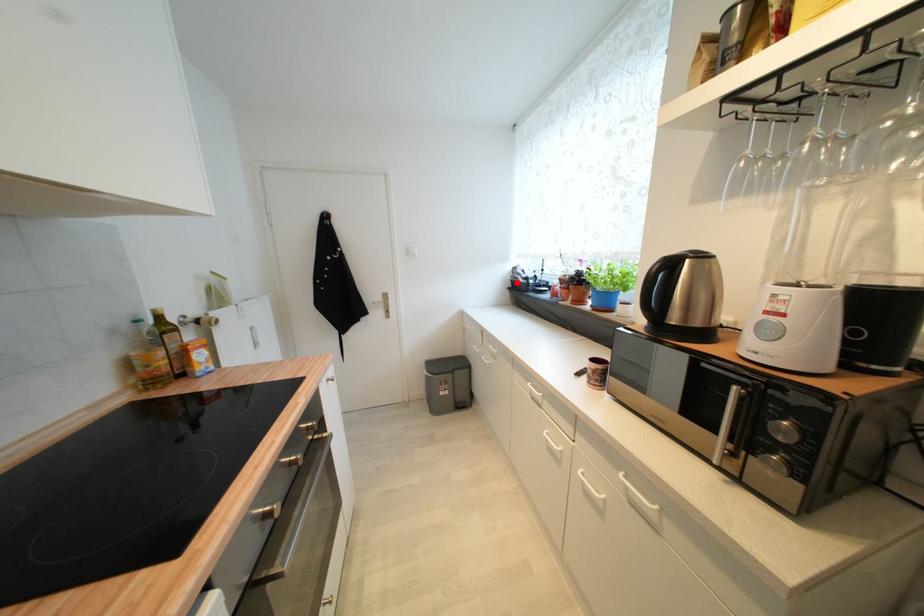
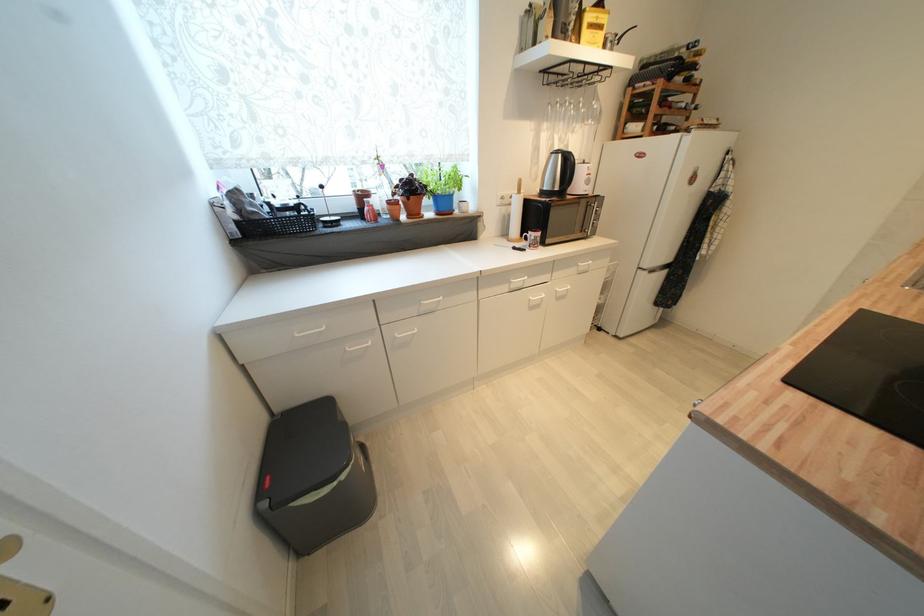
Where in the second image is the point corresponding to the highlighted location from the first image?

(242, 225)